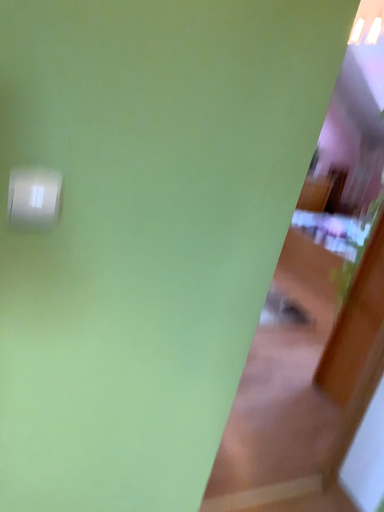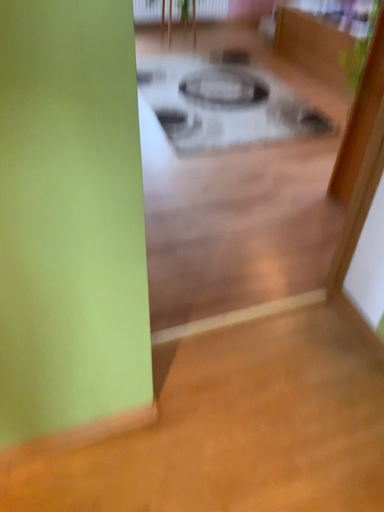
Question: Which way did the camera rotate in the video?

Choices:
 (A) rotated downward
 (B) rotated upward

Answer: (A)